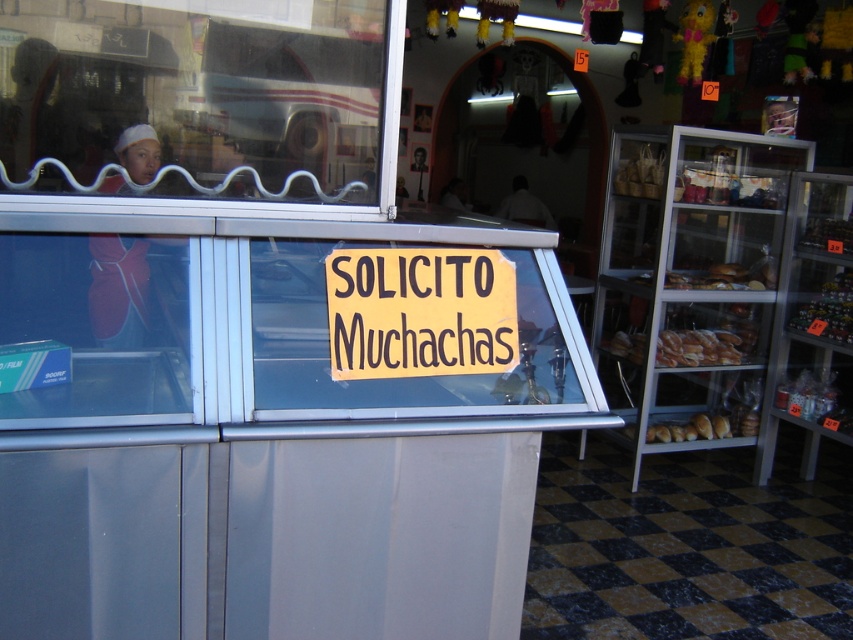
Question: Which object is the closest to the transparent glass window at center?

Choices:
 (A) dark brown bread at right
 (B) yellow paper sign at center

Answer: (B)

Question: Is transparent glass window at center further to camera compared to transparent plastic window at left?

Choices:
 (A) yes
 (B) no

Answer: (A)

Question: Which point appears closest to the camera in this image?

Choices:
 (A) (119, 323)
 (B) (115, 32)
 (C) (421, 301)
 (D) (809, 304)

Answer: (A)

Question: Which point is farther from the camera taking this photo?

Choices:
 (A) (337, 321)
 (B) (836, 288)
 (C) (83, 148)
 (D) (3, 284)

Answer: (B)

Question: Observing the image, what is the correct spatial positioning of transparent glass window at center in reference to transparent plastic window at left?

Choices:
 (A) above
 (B) below

Answer: (A)

Question: Can you confirm if transparent glass window at center is positioned below dark brown bread at right?

Choices:
 (A) no
 (B) yes

Answer: (A)